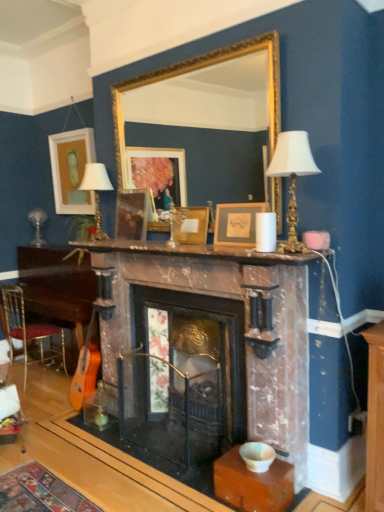
Question: From a real-world perspective, is wooden picture frame at center, which ranks as the 2th picture frame in front-to-back order, below metallic gold chair at lower left?

Choices:
 (A) no
 (B) yes

Answer: (A)

Question: Does wooden picture frame at center, which is the 3th picture frame in back-to-front order, have a lesser height compared to metallic gold chair at lower left?

Choices:
 (A) yes
 (B) no

Answer: (A)

Question: Is wooden picture frame at center, which is the 3th picture frame in back-to-front order, closer to the viewer compared to metallic gold chair at lower left?

Choices:
 (A) no
 (B) yes

Answer: (B)

Question: From the image's perspective, is wooden picture frame at center, which appears as the 2th picture frame when viewed from the right, beneath metallic gold chair at lower left?

Choices:
 (A) yes
 (B) no

Answer: (B)

Question: Is wooden picture frame at center, which ranks as the 2th picture frame in front-to-back order, completely or partially outside of metallic gold chair at lower left?

Choices:
 (A) no
 (B) yes

Answer: (B)

Question: From a real-world perspective, is matte gold picture frame at center, arranged as the 4th picture frame when viewed from the left, positioned above or below white porcelain table lamp at upper center, which is the second table lamp from back to front?

Choices:
 (A) above
 (B) below

Answer: (B)

Question: Looking at the image, does matte gold picture frame at center, arranged as the 4th picture frame when viewed from the left, seem bigger or smaller compared to white porcelain table lamp at upper center, the second table lamp viewed from the left?

Choices:
 (A) big
 (B) small

Answer: (B)

Question: Is point (218, 233) closer or farther from the camera than point (286, 139)?

Choices:
 (A) closer
 (B) farther

Answer: (B)

Question: Is matte gold picture frame at center, arranged as the 4th picture frame when viewed from the left, taller or shorter than white porcelain table lamp at upper center, which is the second table lamp from back to front?

Choices:
 (A) tall
 (B) short

Answer: (B)

Question: From the image's perspective, is marble fireplace at center above or below white porcelain table lamp at upper center, which is the second table lamp from back to front?

Choices:
 (A) above
 (B) below

Answer: (B)

Question: Does point (236, 384) appear closer or farther from the camera than point (284, 158)?

Choices:
 (A) farther
 (B) closer

Answer: (A)

Question: Looking at the image, does marble fireplace at center seem bigger or smaller compared to white porcelain table lamp at upper center, marked as the first table lamp in a front-to-back arrangement?

Choices:
 (A) big
 (B) small

Answer: (A)

Question: Considering the relative positions of marble fireplace at center and white porcelain table lamp at upper center, the first table lamp in the right-to-left sequence, in the image provided, is marble fireplace at center to the left or to the right of white porcelain table lamp at upper center, the first table lamp in the right-to-left sequence,?

Choices:
 (A) left
 (B) right

Answer: (A)

Question: Would you say matte white lampshade at upper left, placed as the first table lamp when sorted from back to front, is to the left or to the right of marble mantel at center in the picture?

Choices:
 (A) right
 (B) left

Answer: (B)

Question: From the image's perspective, is matte white lampshade at upper left, which ranks as the first table lamp in left-to-right order, positioned above or below marble mantel at center?

Choices:
 (A) above
 (B) below

Answer: (A)